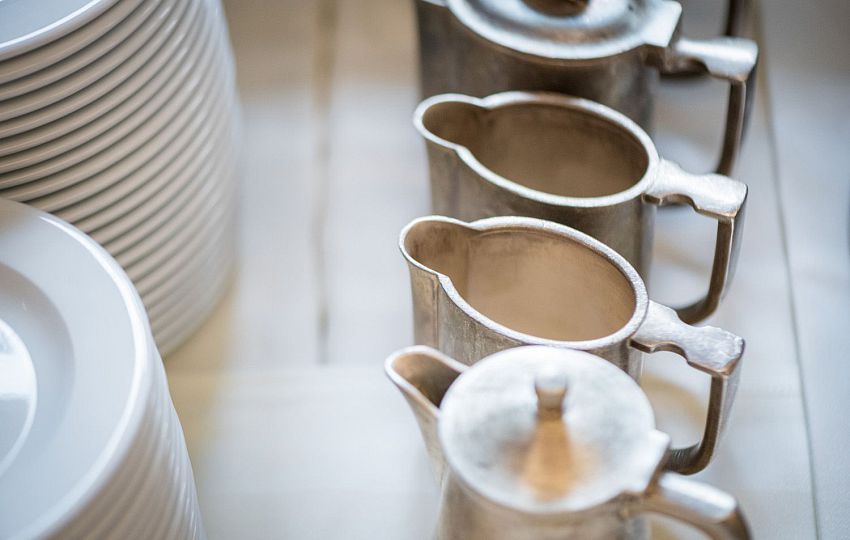
Where is `creamers`? The image size is (850, 540). creamers is located at coordinates (533, 42), (525, 107), (512, 231), (518, 414).